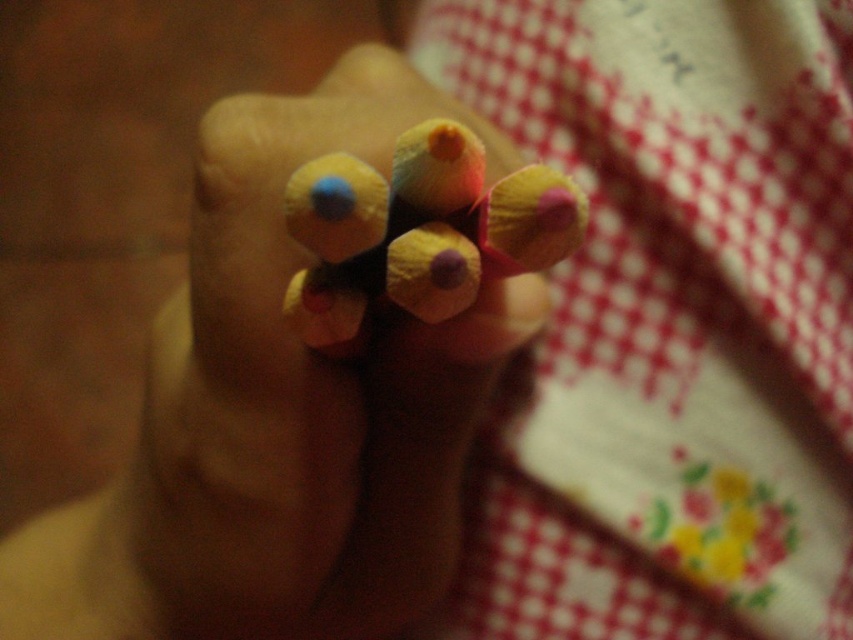
Does wooden pencil case at center appear on the left side of matte wooden pencils at center?

Indeed, wooden pencil case at center is positioned on the left side of matte wooden pencils at center.

Between wooden pencil case at center and matte wooden pencils at center, which one appears on the right side from the viewer's perspective?

matte wooden pencils at center is more to the right.

Which is behind, point (494, 177) or point (369, 211)?

Positioned behind is point (494, 177).

I want to click on wooden pencil case at center, so click(x=308, y=392).

Can you confirm if white dotted fabric at upper center is positioned above matte wooden pencils at center?

Indeed, white dotted fabric at upper center is positioned over matte wooden pencils at center.

Is white dotted fabric at upper center in front of matte wooden pencils at center?

That is False.

Is point (642, 125) positioned in front of point (407, 221)?

No.

Find the location of a particular element. white dotted fabric at upper center is located at coordinates (670, 321).

Is white dotted fabric at upper center shorter than wooden pencil case at center?

Incorrect, white dotted fabric at upper center's height does not fall short of wooden pencil case at center's.

Is white dotted fabric at upper center wider than wooden pencil case at center?

Correct, the width of white dotted fabric at upper center exceeds that of wooden pencil case at center.

This screenshot has width=853, height=640. What do you see at coordinates (670, 321) in the screenshot? I see `white dotted fabric at upper center` at bounding box center [670, 321].

This screenshot has width=853, height=640. What are the coordinates of `white dotted fabric at upper center` in the screenshot? It's located at (670, 321).